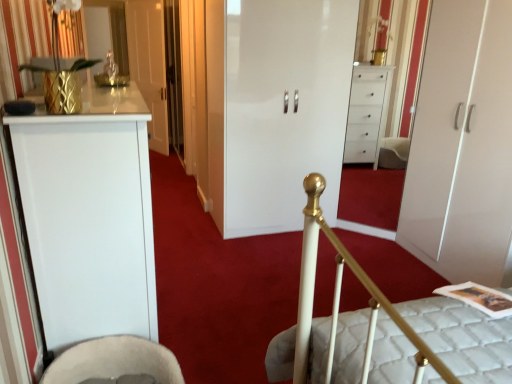
Question: Is gold textured pineapple at upper left closer to the viewer compared to beige fabric rocking chair at lower left?

Choices:
 (A) yes
 (B) no

Answer: (A)

Question: Is gold textured pineapple at upper left next to beige fabric rocking chair at lower left?

Choices:
 (A) no
 (B) yes

Answer: (A)

Question: Is gold textured pineapple at upper left behind beige fabric rocking chair at lower left?

Choices:
 (A) yes
 (B) no

Answer: (B)

Question: Considering the relative sizes of gold textured pineapple at upper left and beige fabric rocking chair at lower left in the image provided, is gold textured pineapple at upper left thinner than beige fabric rocking chair at lower left?

Choices:
 (A) yes
 (B) no

Answer: (A)

Question: Is gold textured pineapple at upper left positioned far away from beige fabric rocking chair at lower left?

Choices:
 (A) no
 (B) yes

Answer: (B)

Question: In terms of size, does white glossy cabinet at center, placed as the 2th door when sorted from front to back, appear bigger or smaller than white glossy door at upper left, which is the 3th door from right to left?

Choices:
 (A) big
 (B) small

Answer: (A)

Question: Would you say white glossy cabinet at center, which is the 2th door from left to right, is inside or outside white glossy door at upper left, the first door viewed from the left?

Choices:
 (A) inside
 (B) outside

Answer: (B)

Question: Visually, is white glossy cabinet at center, which is the 2th door from left to right, positioned to the left or to the right of white glossy door at upper left, which is the 3th door from right to left?

Choices:
 (A) left
 (B) right

Answer: (B)

Question: From the image's perspective, is white glossy cabinet at center, the second door from the right, positioned above or below white glossy door at upper left, which is the 3th door from right to left?

Choices:
 (A) below
 (B) above

Answer: (A)

Question: In the image, is beige fabric rocking chair at lower left positioned in front of or behind gold textured pineapple at upper left?

Choices:
 (A) behind
 (B) front

Answer: (A)

Question: From the image's perspective, is beige fabric rocking chair at lower left positioned above or below gold textured pineapple at upper left?

Choices:
 (A) above
 (B) below

Answer: (B)

Question: Is beige fabric rocking chair at lower left spatially inside gold textured pineapple at upper left, or outside of it?

Choices:
 (A) inside
 (B) outside

Answer: (B)

Question: Considering the positions of beige fabric rocking chair at lower left and gold textured pineapple at upper left in the image, is beige fabric rocking chair at lower left taller or shorter than gold textured pineapple at upper left?

Choices:
 (A) short
 (B) tall

Answer: (A)

Question: Is beige fabric rocking chair at lower left to the left or to the right of white quilted mattress at center in the image?

Choices:
 (A) right
 (B) left

Answer: (B)

Question: Which is correct: beige fabric rocking chair at lower left is inside white quilted mattress at center, or outside of it?

Choices:
 (A) inside
 (B) outside

Answer: (B)